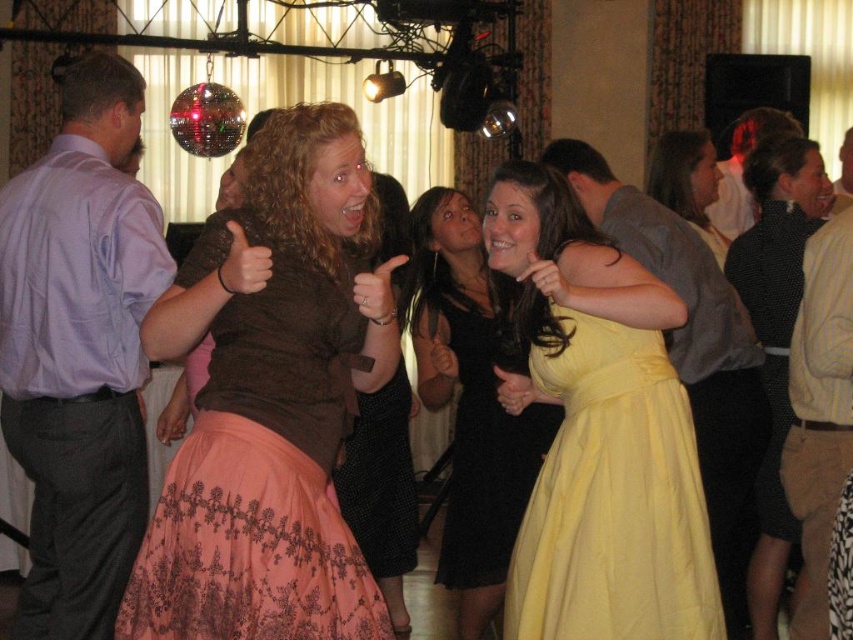
You are a photographer at this event and need to adjust your camera focus. Which object should you focus on first if the matte brown blouse at center is closer to you than the light brown hair at upper right?

You should focus on the matte brown blouse at center first because it is closer to you than the light brown hair at upper right.

You are a photographer at the event and want to capture a photo of both the matte brown blouse at center and the light brown hair at upper right in the same frame. The camera you are using has a maximum focus range of 10 feet. Will you be able to include both subjects in the photo without moving closer?

The distance between the matte brown blouse at center and the light brown hair at upper right is 12.92 feet, which exceeds the camera maximum focus range of 10 feet. Therefore, you cannot capture both subjects in the same frame without moving closer.

You are at a party and notice two dresses at the center of the room. The yellow satin dress at center and the matte yellow dress at center. Which one is closer to you?

The yellow satin dress at center is closer to you because it is in front of the matte yellow dress at center.